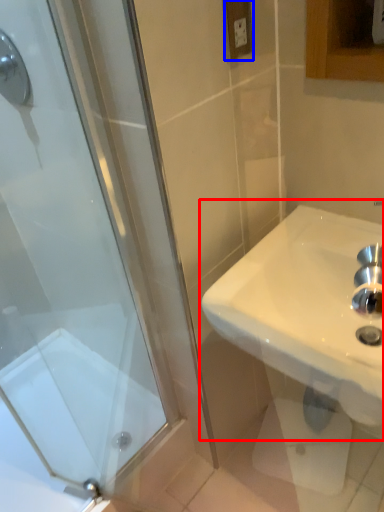
Question: Which object appears closest to the camera in this image, sink (highlighted by a red box) or electric outlet (highlighted by a blue box)?

Choices:
 (A) sink
 (B) electric outlet

Answer: (A)